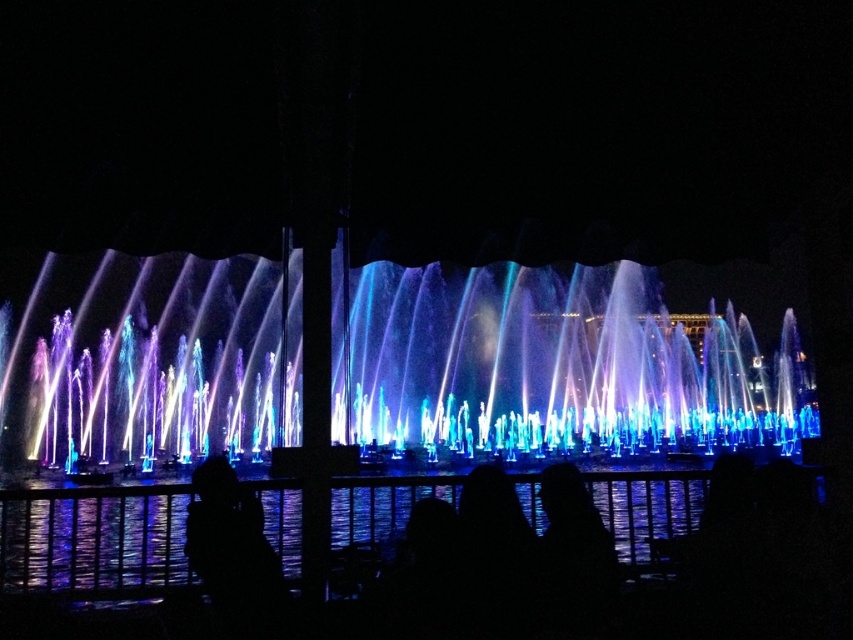
Question: Is blue reflective water at center above black matte person at lower left?

Choices:
 (A) no
 (B) yes

Answer: (A)

Question: Which is farther from the black matte person at lower left?

Choices:
 (A) blue reflective water at center
 (B) iridescent water at center

Answer: (B)

Question: Does iridescent water at center have a larger size compared to blue reflective water at center?

Choices:
 (A) no
 (B) yes

Answer: (B)

Question: Which object is the farthest from the blue reflective water at center?

Choices:
 (A) iridescent water at center
 (B) black matte person at lower left

Answer: (A)

Question: Is iridescent water at center positioned at the back of blue reflective water at center?

Choices:
 (A) yes
 (B) no

Answer: (A)

Question: Which point is closer to the camera?

Choices:
 (A) black matte person at lower left
 (B) blue reflective water at center

Answer: (B)